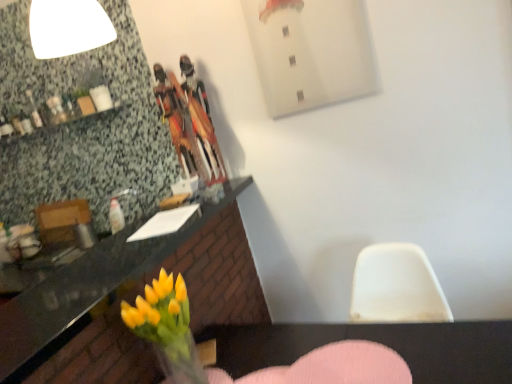
Locate an element on the screen. The width and height of the screenshot is (512, 384). free space above pink fabric armchair at lower center (from a real-world perspective) is located at coordinates (271, 361).